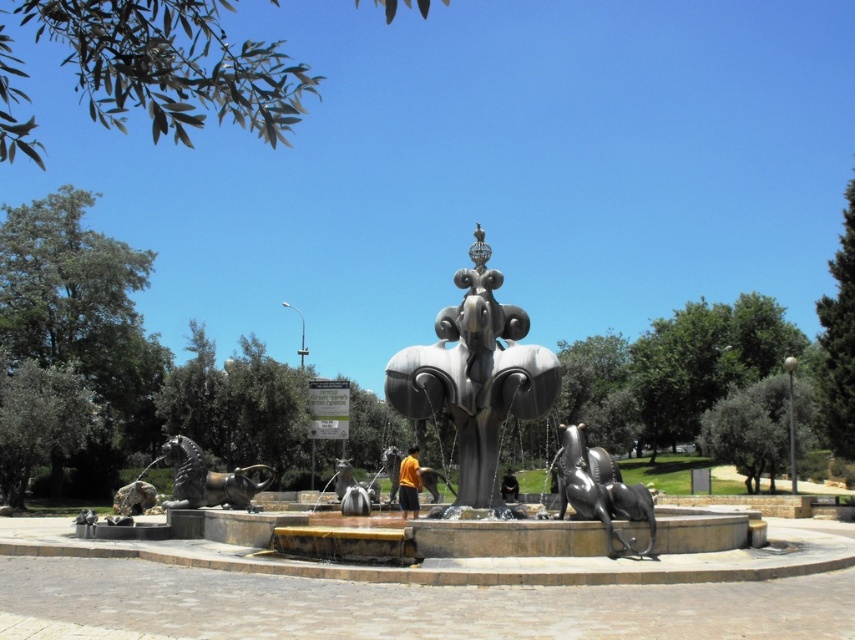
You are standing at the edge of the paved area and want to pour a drink into the polished silver fountain at center. However, there is a polished silver sculpture at center in the way. Can you pour the drink directly into the fountain without moving the sculpture?

The polished silver fountain at center is located above the polished silver sculpture at center, so you can pour the drink directly into the fountain without needing to move the sculpture since it is positioned above the sculpture.

You are standing at the point labeled point (499, 440) in the image. What object are you directly facing?

You are directly facing the polished silver fountain at center, as the point (499, 440) indicates the location of the fountain.

You are standing at the entrance of the park, which is located at point 0.0, 0.0. You want to go to the polished silver fountain at center. Which direction should you go?

The polished silver fountain at center is located at point (499,440). Since you are at (0,0), you should move towards the northeast direction to reach it.